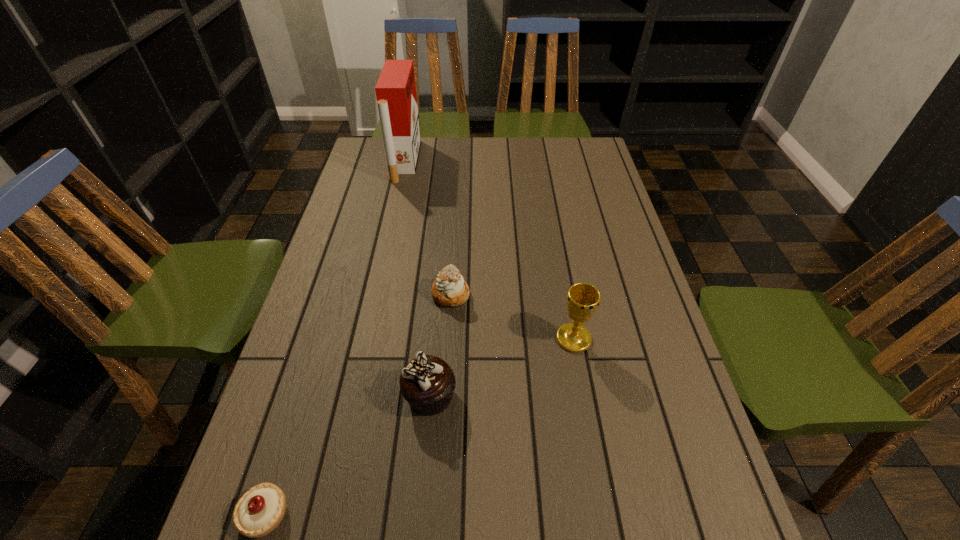
I want to click on vacant area situated on the back of the cupcake, so click(441, 279).

At what (x,y) coordinates should I click in order to perform the action: click on free space located on the front of the taller pastry. Please return your answer as a coordinate pair (x, y). The height and width of the screenshot is (540, 960). Looking at the image, I should click on (444, 417).

I want to click on object located at the far edge, so click(395, 90).

Where is `object that is at the left edge`? Image resolution: width=960 pixels, height=540 pixels. object that is at the left edge is located at coordinates (395, 90).

Identify the location of object situated at the far left corner. The image size is (960, 540). (395, 90).

Where is `free space at the far edge of the desktop`? This screenshot has height=540, width=960. free space at the far edge of the desktop is located at coordinates (513, 156).

This screenshot has height=540, width=960. I want to click on blank space at the left edge of the desktop, so click(283, 441).

Identify the location of vacant space at the right edge of the desktop. The height and width of the screenshot is (540, 960). (684, 505).

Find the location of a particular element. The width and height of the screenshot is (960, 540). vacant space at the far left corner is located at coordinates (377, 153).

The image size is (960, 540). I want to click on free space that is in between the cupcake and the fourth shortest object, so click(502, 367).